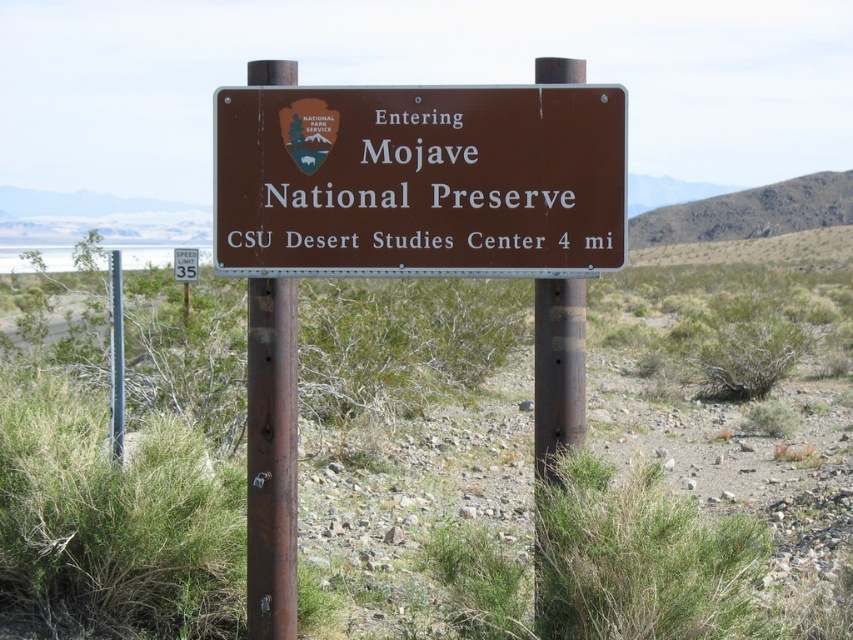
Which of these two, brown metallic sign at center or white plastic speed limit sign at upper center, stands shorter?

With less height is brown metallic sign at center.

Between point (322, 176) and point (177, 278), which one is positioned in front?

Point (322, 176) is in front.

Where is `brown metallic sign at center`? Image resolution: width=853 pixels, height=640 pixels. brown metallic sign at center is located at coordinates (419, 180).